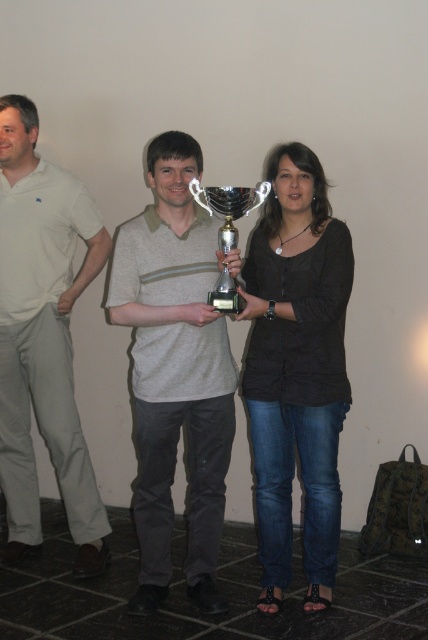
Question: Which object appears farthest from the camera in this image?

Choices:
 (A) silver metallic trophy at center
 (B) black matte shirt at center

Answer: (B)

Question: Does white cotton shirt at left appear on the right side of silver metallic trophy at center?

Choices:
 (A) yes
 (B) no

Answer: (B)

Question: Which object is the farthest from the silver metallic trophy at center?

Choices:
 (A) gray striped polo shirt at center
 (B) black matte shirt at center
 (C) white cotton shirt at left

Answer: (C)

Question: Does white cotton shirt at left come in front of silver metallic trophy at center?

Choices:
 (A) no
 (B) yes

Answer: (A)

Question: Is gray striped polo shirt at center thinner than white cotton shirt at left?

Choices:
 (A) no
 (B) yes

Answer: (B)

Question: Which point is farther to the camera?

Choices:
 (A) gray striped polo shirt at center
 (B) silver metallic trophy at center
 (C) white cotton shirt at left

Answer: (C)